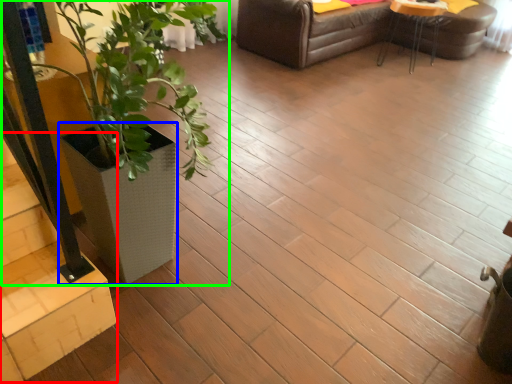
Question: Considering the real-world distances, which object is closest to stairwell (highlighted by a red box)? flowerpot (highlighted by a blue box) or houseplant (highlighted by a green box).

Choices:
 (A) flowerpot
 (B) houseplant

Answer: (A)